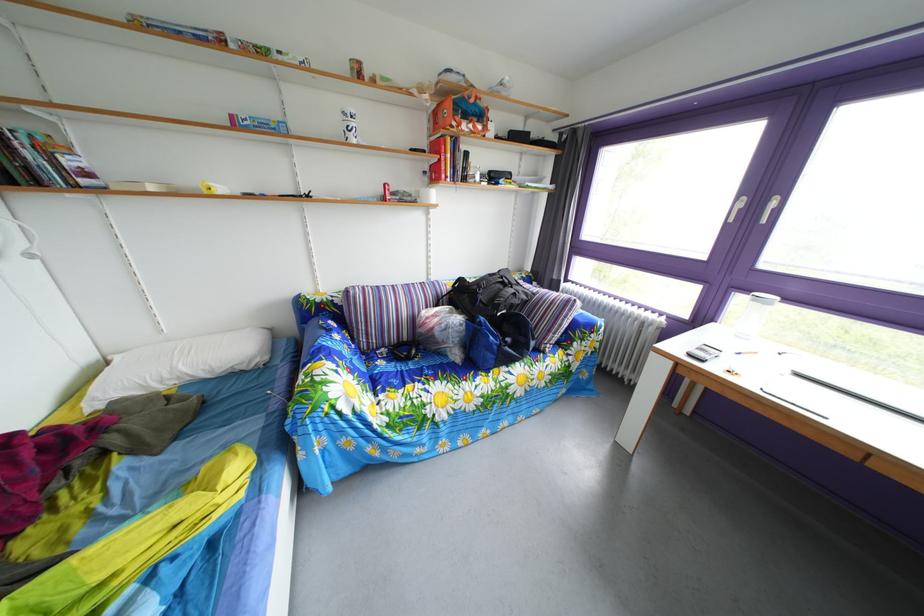
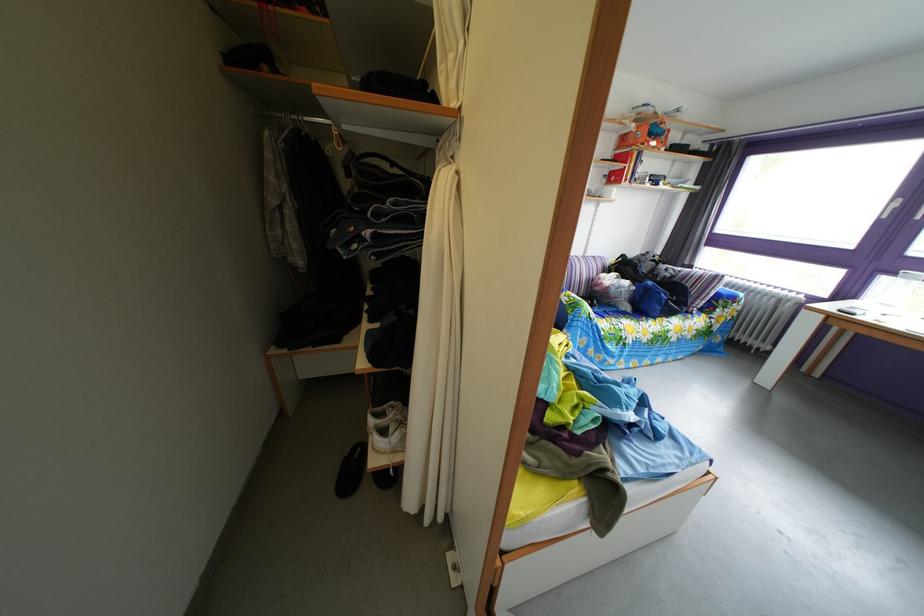
Where in the second image is the point corresponding to [492,328] from the first image?

(661, 291)